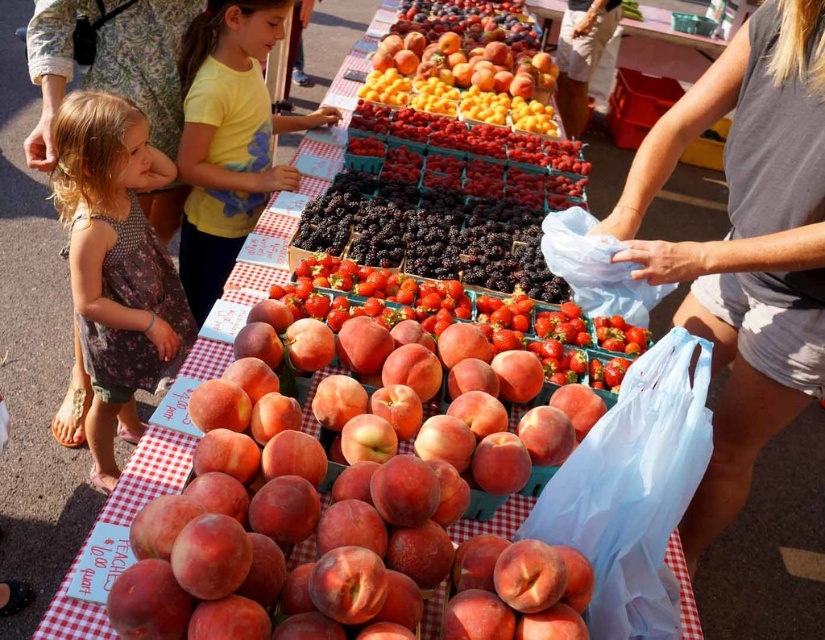
Question: Is the position of floral dress at left less distant than that of yellow cotton shirt at upper center?

Choices:
 (A) yes
 (B) no

Answer: (A)

Question: Is yellow cotton shirt at upper center to the left of glossy yellow apricots at center from the viewer's perspective?

Choices:
 (A) yes
 (B) no

Answer: (A)

Question: Can you confirm if yellow cotton shirt at upper center is wider than glossy yellow apricots at center?

Choices:
 (A) yes
 (B) no

Answer: (B)

Question: Which of the following is the closest to the observer?

Choices:
 (A) (185, 109)
 (B) (394, 61)

Answer: (A)

Question: Which object is closer to the camera taking this photo?

Choices:
 (A) matte gray tank top at center
 (B) floral dress at left
 (C) yellow cotton shirt at upper center
 (D) glossy yellow apricots at center

Answer: (A)

Question: Which of the following is the farthest from the observer?

Choices:
 (A) floral dress at left
 (B) yellow cotton shirt at upper center

Answer: (B)